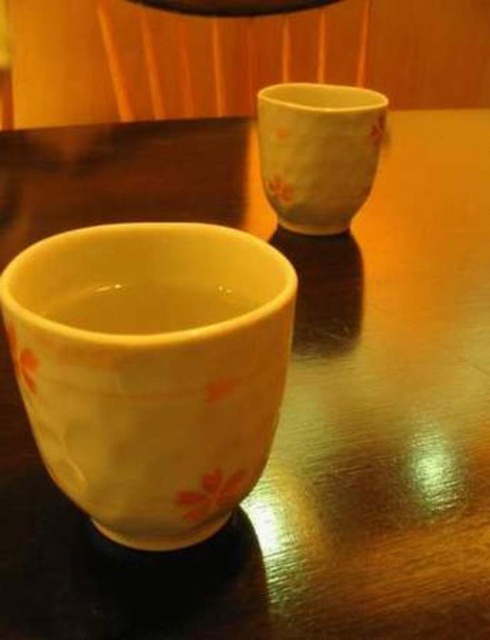
Looking at this image, can you confirm if yellow glazed cup at lower left is bigger than matte ceramic cup at upper right?

No.

Is point (182, 454) behind point (346, 112)?

No, it is not.

Between point (122, 422) and point (323, 166), which one is positioned behind?

The point (323, 166) is behind.

The height and width of the screenshot is (640, 490). Find the location of `yellow glazed cup at lower left`. yellow glazed cup at lower left is located at coordinates (150, 369).